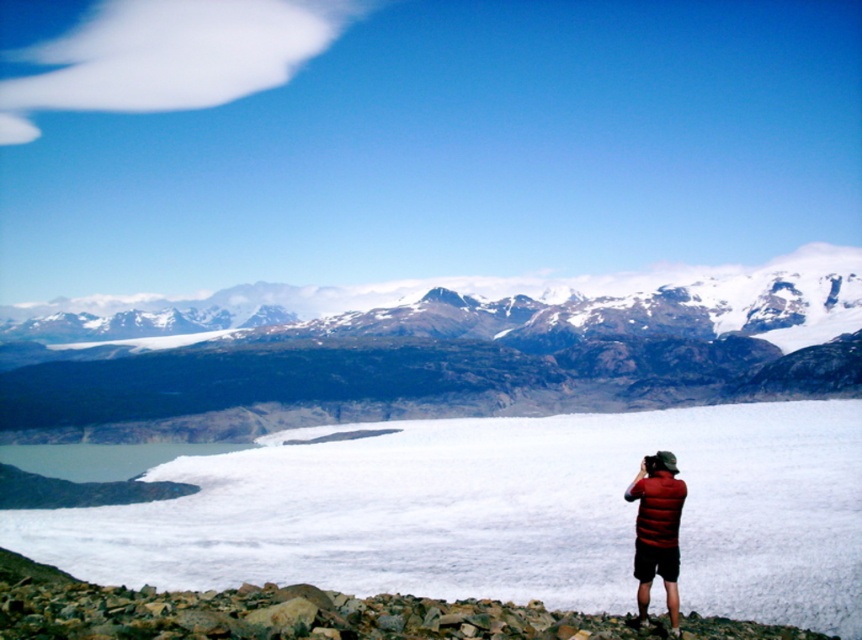
Based on the photo, between white matte snow at center and matte red vest at lower right, which one appears on the left side from the viewer's perspective?

white matte snow at center

Between white matte snow at center and matte red vest at lower right, which one has more height?

white matte snow at center

This screenshot has width=862, height=640. I want to click on white matte snow at center, so click(x=503, y=513).

Who is taller, sandy brown rock formation at center or matte red vest at lower right?

sandy brown rock formation at center is taller.

Can you confirm if sandy brown rock formation at center is bigger than matte red vest at lower right?

Indeed, sandy brown rock formation at center has a larger size compared to matte red vest at lower right.

Which is behind, point (194, 438) or point (638, 595)?

Positioned behind is point (194, 438).

At what (x,y) coordinates should I click in order to perform the action: click on sandy brown rock formation at center. Please return your answer as a coordinate pair (x, y). The width and height of the screenshot is (862, 640). Looking at the image, I should click on (461, 362).

Find the location of a particular element. This screenshot has height=640, width=862. white matte snow at center is located at coordinates (503, 513).

Does point (323, 552) lie in front of point (292, 332)?

That is True.

Where is `white matte snow at center`? The image size is (862, 640). white matte snow at center is located at coordinates 503,513.